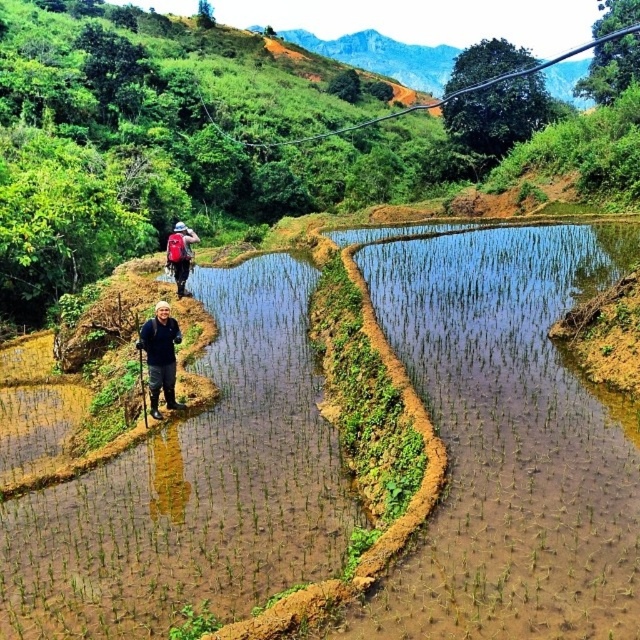
You are standing at the point marked as point (161, 356) in the image. What object is located exactly at that point?

The point (161, 356) corresponds to dark blue jeans at center.

You are standing at the edge of the terraced rice paddies and see the brown soil at center and the matte red backpack at center. Which object is located to the right of the other?

The brown soil at center is positioned on the right side of the matte red backpack at center.